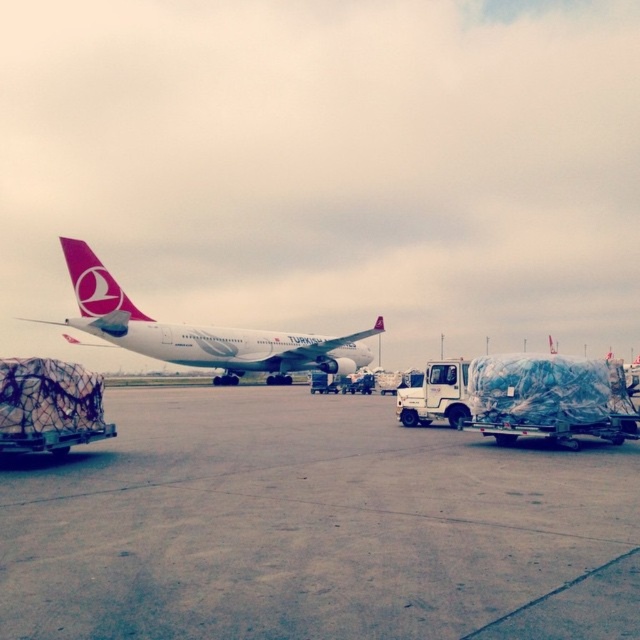
Question: Is concrete tarmac at center positioned before white glossy airplane at center?

Choices:
 (A) yes
 (B) no

Answer: (A)

Question: Which object is positioned closest to the pink matte airplane tail at upper left?

Choices:
 (A) white glossy airplane at center
 (B) concrete tarmac at center

Answer: (A)

Question: Estimate the real-world distances between objects in this image. Which object is farther from the concrete tarmac at center?

Choices:
 (A) pink matte airplane tail at upper left
 (B) white glossy airplane at center

Answer: (B)

Question: Observing the image, what is the correct spatial positioning of white glossy airplane at center in reference to pink matte airplane tail at upper left?

Choices:
 (A) left
 (B) right

Answer: (A)

Question: Which object is positioned closest to the concrete tarmac at center?

Choices:
 (A) pink matte airplane tail at upper left
 (B) white glossy airplane at center

Answer: (A)

Question: Can you confirm if white glossy airplane at center is positioned below pink matte airplane tail at upper left?

Choices:
 (A) yes
 (B) no

Answer: (A)